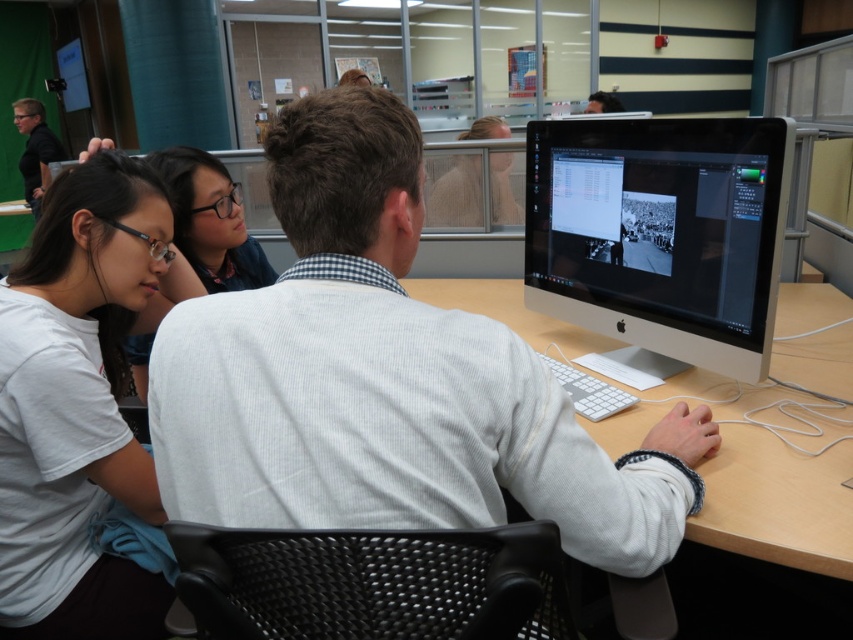
Question: Is white ribbed sweater at center below white plastic computer desk at center?

Choices:
 (A) yes
 (B) no

Answer: (B)

Question: Estimate the real-world distances between objects in this image. Which object is farther from the sleek silver monitor at center?

Choices:
 (A) matte black shirt at left
 (B) white plastic computer desk at center
 (C) white ribbed sweater at center
 (D) white matte shirt at upper left

Answer: (A)

Question: Observing the image, what is the correct spatial positioning of white plastic computer desk at center in reference to matte black shirt at left?

Choices:
 (A) above
 (B) below

Answer: (B)

Question: Based on their relative distances, which object is farther from the white matte shirt at upper left?

Choices:
 (A) white ribbed sweater at center
 (B) matte black glasses at upper left
 (C) sleek silver monitor at center

Answer: (C)

Question: Does sleek silver monitor at center appear on the left side of matte black glasses at upper left?

Choices:
 (A) no
 (B) yes

Answer: (A)

Question: Which object is closer to the camera taking this photo?

Choices:
 (A) matte black shirt at left
 (B) white matte shirt at upper left
 (C) white plastic computer desk at center

Answer: (C)